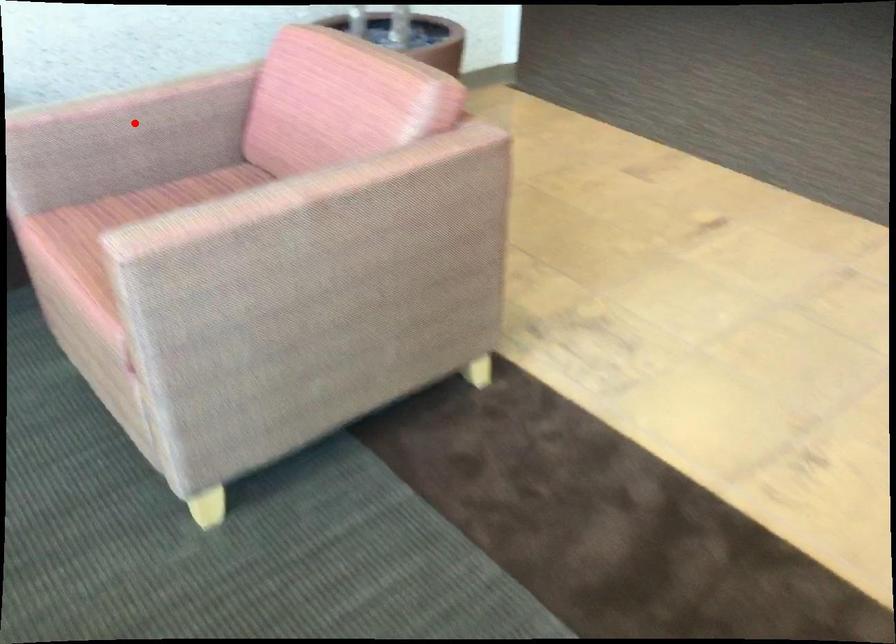
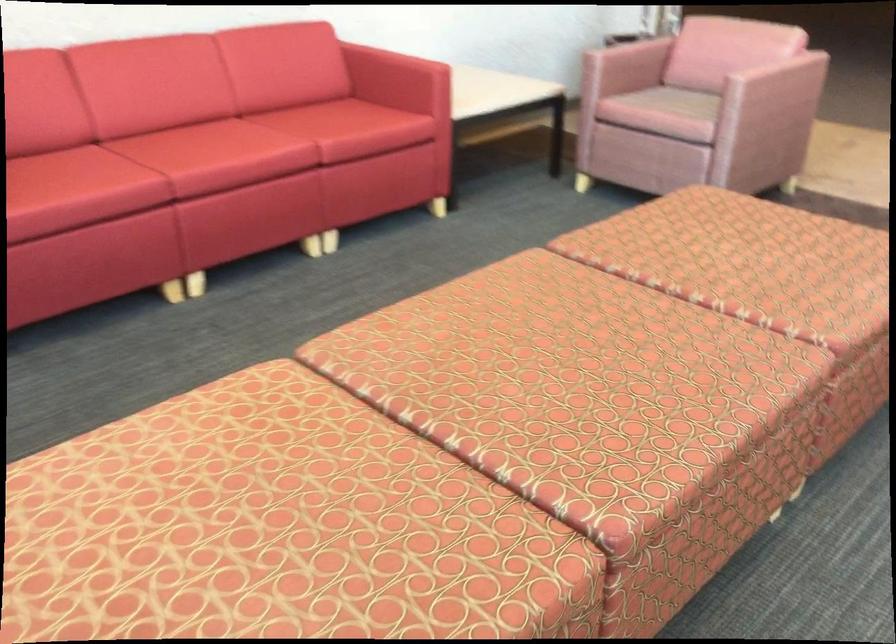
Locate, in the second image, the point that corresponds to the highlighted location in the first image.

(627, 58)